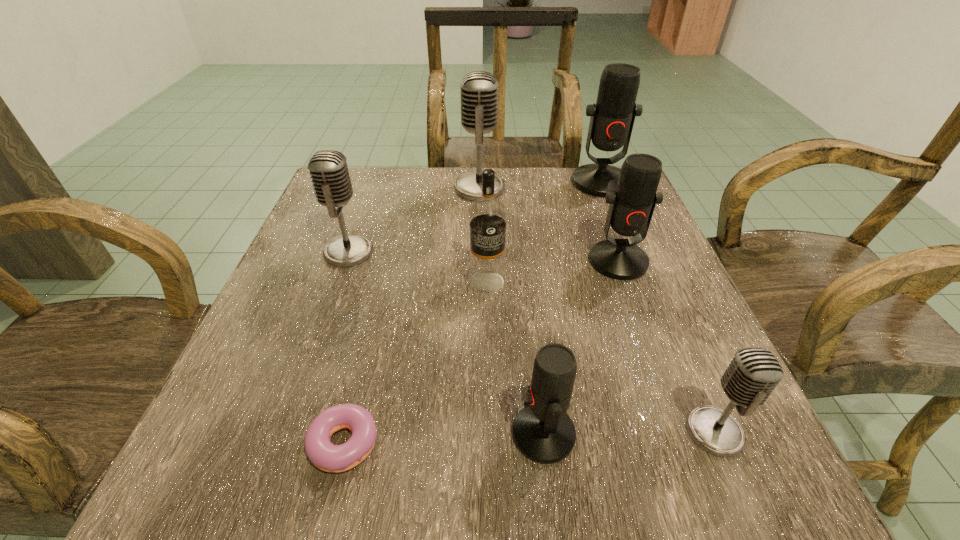
Image resolution: width=960 pixels, height=540 pixels. I want to click on the rightmost gray microphone, so click(753, 373).

Identify the location of the shortest object. Image resolution: width=960 pixels, height=540 pixels. (323, 454).

This screenshot has width=960, height=540. I want to click on doughnut, so click(x=323, y=454).

Locate an element on the screen. The height and width of the screenshot is (540, 960). free space located on the front of the farthest gray microphone is located at coordinates (479, 247).

At what (x,y) coordinates should I click in order to perform the action: click on blank area located 0.060m on the side of the biggest red microphone with the red ring. Please return your answer as a coordinate pair (x, y). The image size is (960, 540). Looking at the image, I should click on (612, 212).

This screenshot has width=960, height=540. What are the coordinates of `free space located on the label of the vodka` in the screenshot? It's located at (488, 347).

Where is `vacant space located 0.150m on the side of the second smallest red microphone with the red ring`? The width and height of the screenshot is (960, 540). vacant space located 0.150m on the side of the second smallest red microphone with the red ring is located at coordinates coord(648,343).

The height and width of the screenshot is (540, 960). In order to click on free space located on the right of the leftmost microphone in this screenshot , I will do coord(477,252).

You are a GUI agent. You are given a task and a screenshot of the screen. Output one action in this format:
    pyautogui.click(x=<x>, y=<y>)
    Task: Click on the vacant region located on the side of the leftmost red microphone with the red ring
    
    Given the screenshot: What is the action you would take?
    pyautogui.click(x=262, y=434)

At what (x,y) coordinates should I click in order to perform the action: click on vacant space located on the side of the leftmost red microphone with the red ring. Please return your answer as a coordinate pair (x, y). Image resolution: width=960 pixels, height=540 pixels. Looking at the image, I should click on (365, 434).